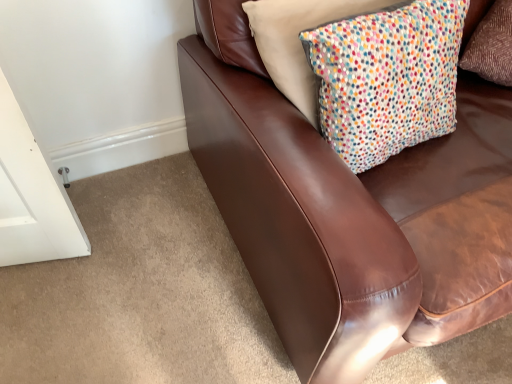
Question: Is brown leather couch at upper right in contact with white dotted fabric pillow at upper right?

Choices:
 (A) yes
 (B) no

Answer: (B)

Question: From a real-world perspective, does brown leather couch at upper right stand above white dotted fabric pillow at upper right?

Choices:
 (A) no
 (B) yes

Answer: (A)

Question: Is the depth of brown leather couch at upper right greater than that of white dotted fabric pillow at upper right?

Choices:
 (A) yes
 (B) no

Answer: (B)

Question: Does brown leather couch at upper right have a greater width compared to white dotted fabric pillow at upper right?

Choices:
 (A) no
 (B) yes

Answer: (B)

Question: Is white dotted fabric pillow at upper right at the back of brown leather couch at upper right?

Choices:
 (A) yes
 (B) no

Answer: (A)

Question: Is brown leather couch at upper right positioned before white dotted fabric pillow at upper right?

Choices:
 (A) no
 (B) yes

Answer: (B)

Question: Does white dotted fabric pillow at upper right come in front of brown leather couch at upper right?

Choices:
 (A) no
 (B) yes

Answer: (A)

Question: Can you confirm if white dotted fabric pillow at upper right is smaller than brown leather couch at upper right?

Choices:
 (A) yes
 (B) no

Answer: (A)

Question: Is white dotted fabric pillow at upper right not close to brown leather couch at upper right?

Choices:
 (A) no
 (B) yes

Answer: (A)

Question: Does white dotted fabric pillow at upper right contain brown leather couch at upper right?

Choices:
 (A) yes
 (B) no

Answer: (B)

Question: Is white dotted fabric pillow at upper right thinner than brown leather couch at upper right?

Choices:
 (A) yes
 (B) no

Answer: (A)

Question: Is white dotted fabric pillow at upper right taller than brown leather couch at upper right?

Choices:
 (A) no
 (B) yes

Answer: (A)

Question: In the image, is brown leather couch at upper right on the left side or the right side of white dotted fabric pillow at upper right?

Choices:
 (A) left
 (B) right

Answer: (B)